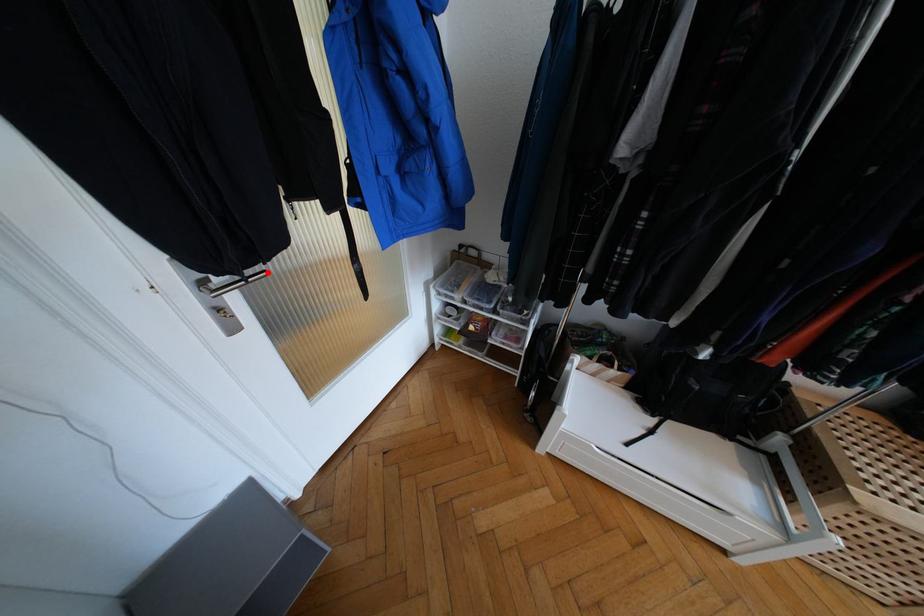
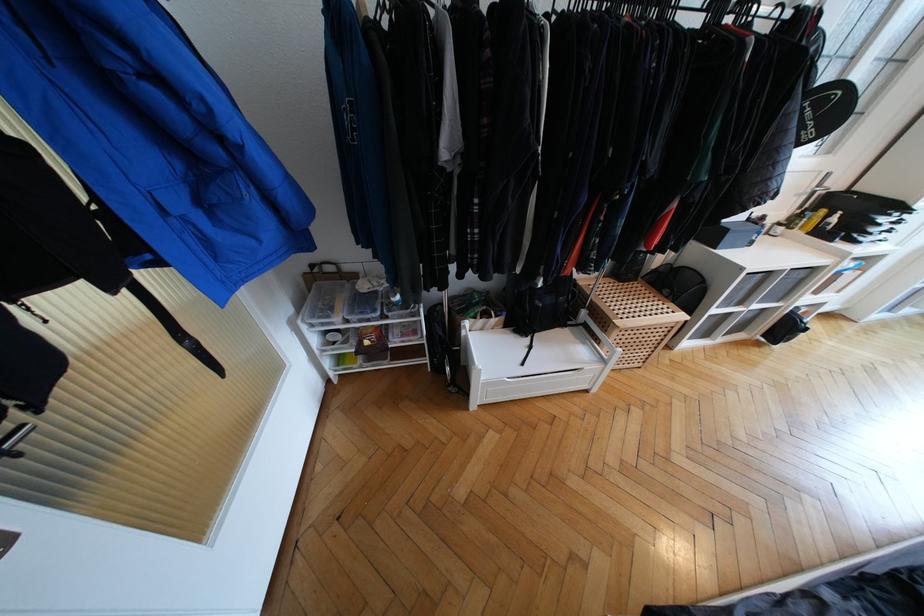
Where in the second image is the point corresponding to the highlighted location from the first image?

(25, 428)